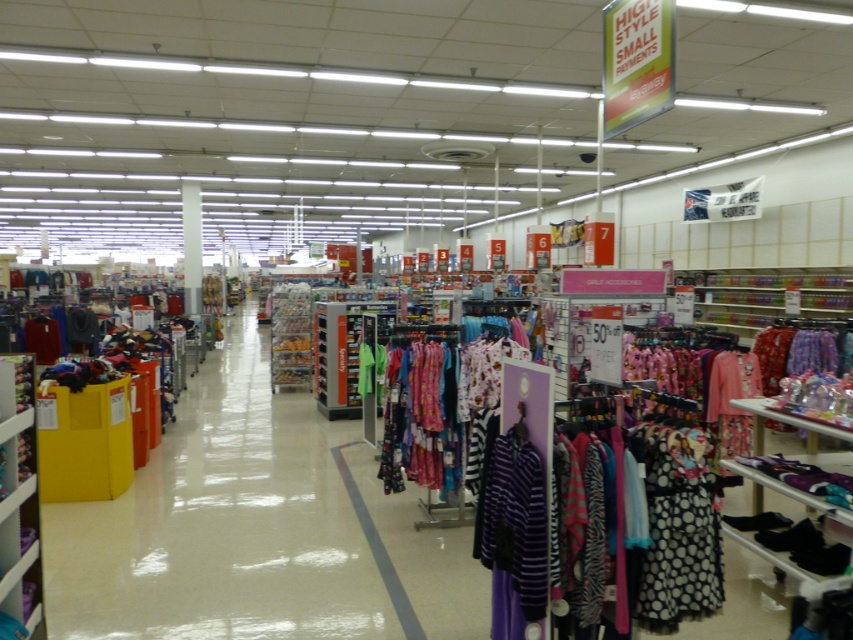
Question: Which is nearer to the printed cotton pajamas at center?

Choices:
 (A) matte plastic shelf at lower left
 (B) matte plastic clothing rack at center
 (C) black dotted dress at lower right
 (D) purple striped shirt at lower center

Answer: (B)

Question: From the image, what is the correct spatial relationship of black dotted dress at lower right in relation to purple striped shirt at lower center?

Choices:
 (A) above
 (B) below

Answer: (A)

Question: Which object is the closest to the purple striped shirt at lower center?

Choices:
 (A) black dotted dress at lower right
 (B) matte plastic shelf at lower left
 (C) matte plastic clothing rack at center
 (D) printed cotton pajamas at center

Answer: (A)

Question: Is matte plastic clothing rack at center below printed cotton pajamas at center?

Choices:
 (A) yes
 (B) no

Answer: (A)

Question: Based on their relative distances, which object is farther from the black dotted dress at lower right?

Choices:
 (A) matte plastic clothing rack at center
 (B) purple striped shirt at lower center
 (C) matte plastic shelf at lower left
 (D) printed cotton pajamas at center

Answer: (C)

Question: Where is purple striped shirt at lower center located in relation to printed cotton pajamas at center in the image?

Choices:
 (A) right
 (B) left

Answer: (A)